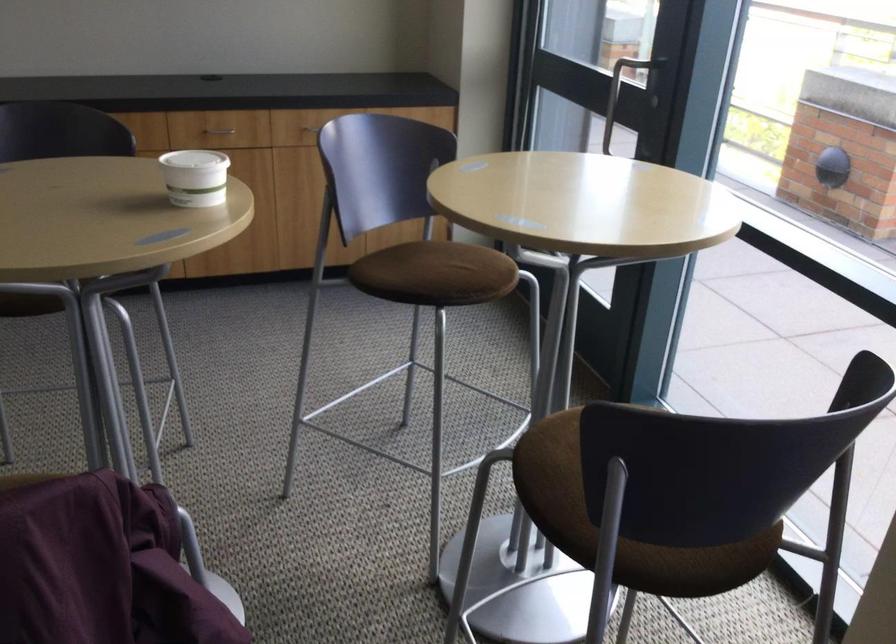
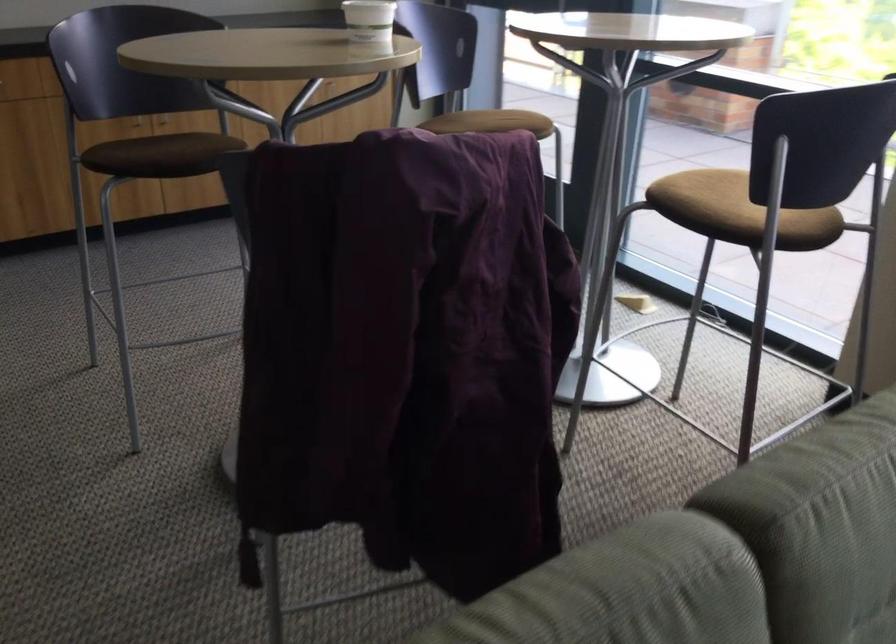
Question: The images are taken continuously from a first-person perspective. In which direction is your viewpoint rotating?

Choices:
 (A) Left
 (B) Right
 (C) Up
 (D) Down

Answer: (B)